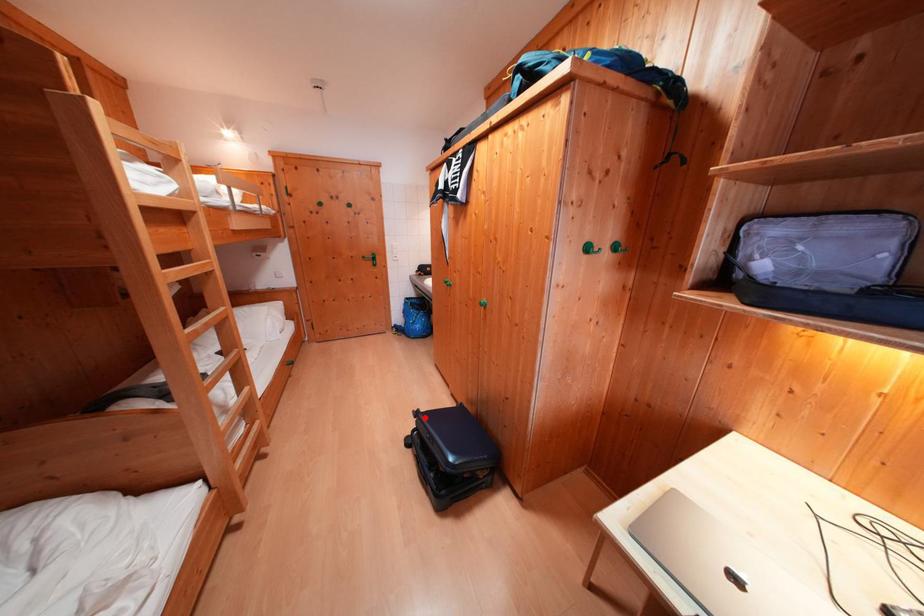
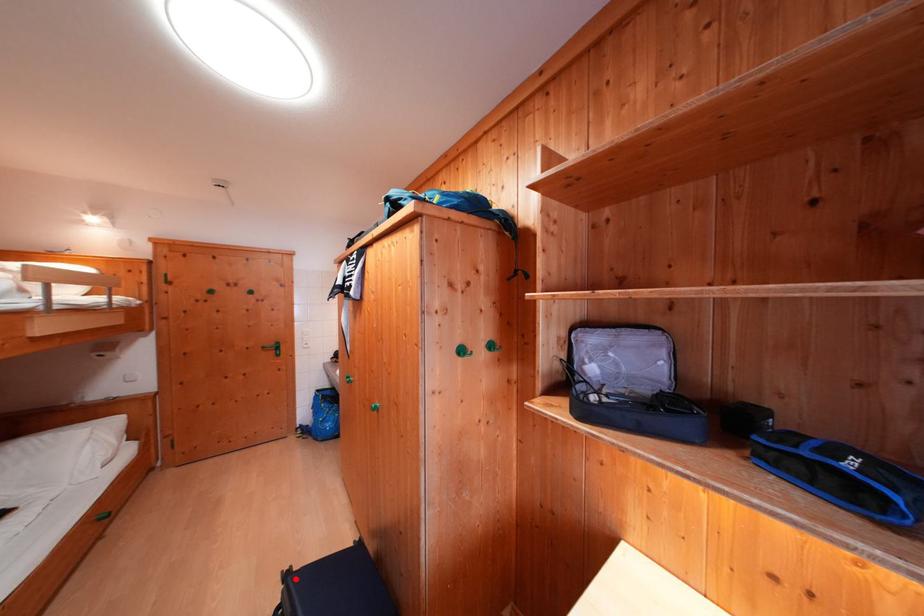
I am providing you with two images of the same scene from different viewpoints. A red point is marked on the first image and another point is marked on the second image. Is the red point in image1 aligned with the point shown in image2?

Yes